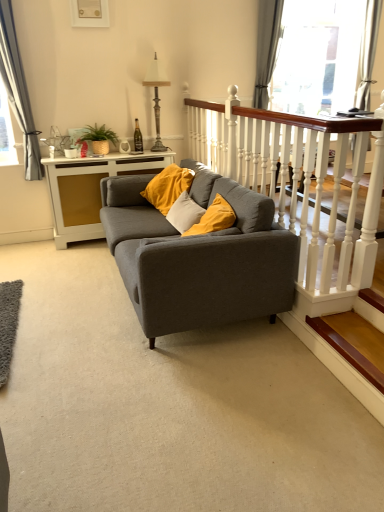
Question: From a real-world perspective, does wooden at lower right stand above matte gray couch at center?

Choices:
 (A) yes
 (B) no

Answer: (B)

Question: From the image's perspective, is wooden at lower right on top of matte gray couch at center?

Choices:
 (A) yes
 (B) no

Answer: (B)

Question: From a real-world perspective, is wooden at lower right positioned under matte gray couch at center based on gravity?

Choices:
 (A) yes
 (B) no

Answer: (A)

Question: Is wooden at lower right wider than matte gray couch at center?

Choices:
 (A) no
 (B) yes

Answer: (A)

Question: Considering the relative positions of wooden at lower right and matte gray couch at center in the image provided, is wooden at lower right to the left of matte gray couch at center from the viewer's perspective?

Choices:
 (A) no
 (B) yes

Answer: (A)

Question: Considering the relative positions of antique bronze lamp at upper center and matte white picture frame at upper center in the image provided, is antique bronze lamp at upper center to the left or to the right of matte white picture frame at upper center?

Choices:
 (A) right
 (B) left

Answer: (A)

Question: Relative to matte white picture frame at upper center, is antique bronze lamp at upper center in front or behind?

Choices:
 (A) behind
 (B) front

Answer: (A)

Question: From a real-world perspective, is antique bronze lamp at upper center positioned above or below matte white picture frame at upper center?

Choices:
 (A) below
 (B) above

Answer: (A)

Question: Do you think antique bronze lamp at upper center is within matte white picture frame at upper center, or outside of it?

Choices:
 (A) inside
 (B) outside

Answer: (B)

Question: Looking at the image, does matte white picture frame at upper center seem bigger or smaller compared to white wood balustrade at upper right?

Choices:
 (A) small
 (B) big

Answer: (A)

Question: Is matte white picture frame at upper center inside the boundaries of white wood balustrade at upper right, or outside?

Choices:
 (A) outside
 (B) inside

Answer: (A)

Question: From a real-world perspective, relative to white wood balustrade at upper right, is matte white picture frame at upper center vertically above or below?

Choices:
 (A) above
 (B) below

Answer: (A)

Question: Looking at their shapes, would you say matte white picture frame at upper center is wider or thinner than white wood balustrade at upper right?

Choices:
 (A) wide
 (B) thin

Answer: (B)

Question: From a real-world perspective, is matte gray couch at center positioned above or below matte white picture frame at upper center?

Choices:
 (A) below
 (B) above

Answer: (A)

Question: Is matte gray couch at center taller or shorter than matte white picture frame at upper center?

Choices:
 (A) tall
 (B) short

Answer: (A)